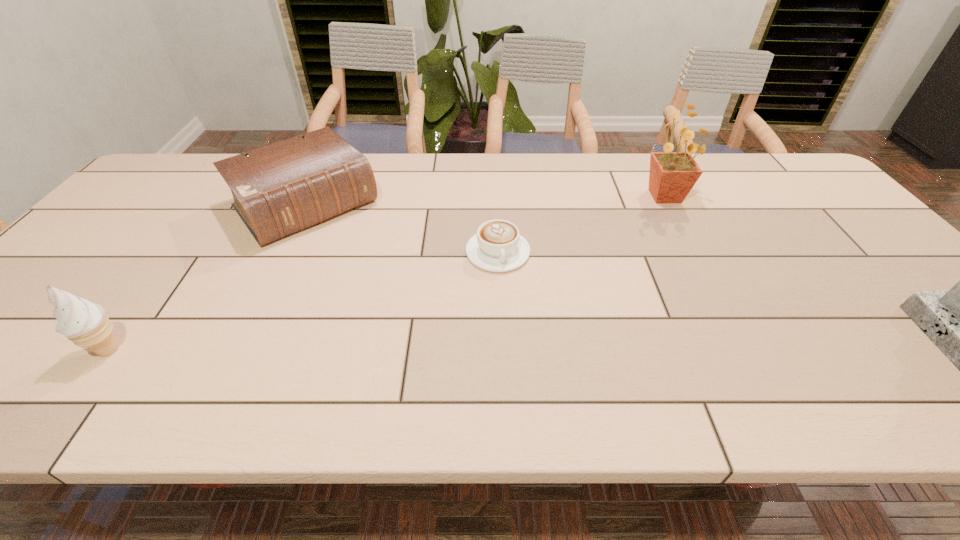
Where is `free space at the far edge`? This screenshot has width=960, height=540. free space at the far edge is located at coordinates (604, 158).

Find the location of a particular element. The width and height of the screenshot is (960, 540). vacant region at the near edge is located at coordinates (815, 350).

The height and width of the screenshot is (540, 960). What are the coordinates of `free space at the left edge of the desktop` in the screenshot? It's located at (58, 276).

In the image, there is a desktop. Where is `vacant space at the right edge`? The image size is (960, 540). vacant space at the right edge is located at coordinates (786, 206).

This screenshot has width=960, height=540. What are the coordinates of `free region at the far left corner of the desktop` in the screenshot? It's located at (183, 178).

Image resolution: width=960 pixels, height=540 pixels. Find the location of `vacant space at the far right corner`. vacant space at the far right corner is located at coordinates (815, 187).

You are a GUI agent. You are given a task and a screenshot of the screen. Output one action in this format:
    pyautogui.click(x=<x>, y=<y>)
    Task: Click on the free space between the rightmost object and the third object from left to right
    The image size is (960, 540).
    Given the screenshot: What is the action you would take?
    [x=582, y=225]

Find the location of a particular element. free space between the second shortest object and the third object from left to right is located at coordinates (402, 228).

Image resolution: width=960 pixels, height=540 pixels. Find the location of `empty space that is in between the rightmost object and the Bible`. empty space that is in between the rightmost object and the Bible is located at coordinates (486, 201).

Identify which object is the nearest to the tallest object. Please provide its 2D coordinates. Your answer should be formatted as a tuple, i.e. [(x, y)], where the tuple contains the x and y coordinates of a point satisfying the conditions above.

[(497, 247)]